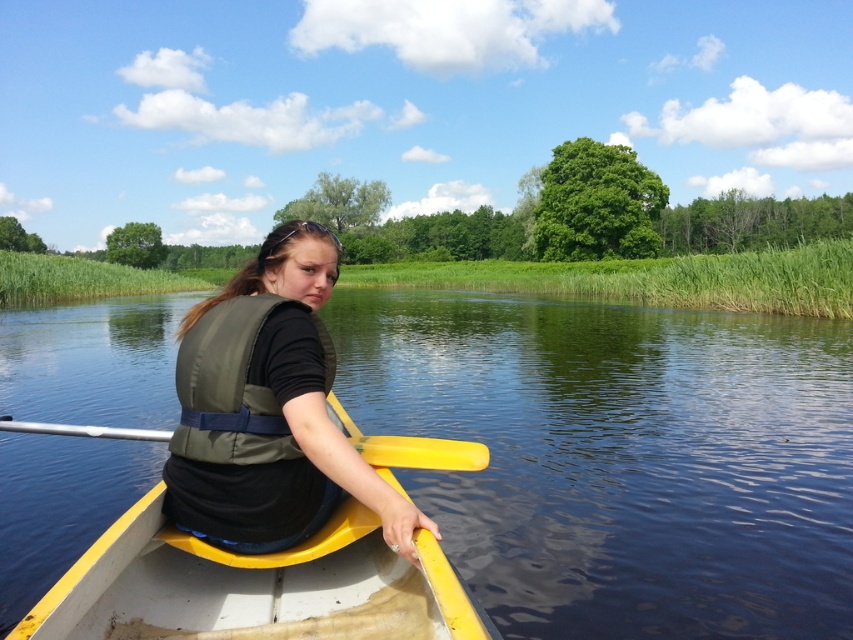
Question: Which point appears closest to the camera in this image?

Choices:
 (A) pyautogui.click(x=9, y=428)
 (B) pyautogui.click(x=323, y=461)

Answer: (B)

Question: Is olive green life vest at center below yellow plastic paddle at center?

Choices:
 (A) no
 (B) yes

Answer: (A)

Question: Can you confirm if yellow plastic boat at center is bigger than yellow plastic paddle at center?

Choices:
 (A) yes
 (B) no

Answer: (A)

Question: Which of the following is the closest to the observer?

Choices:
 (A) (187, 577)
 (B) (311, 420)
 (C) (605, 355)
 (D) (473, 444)

Answer: (B)

Question: Which object appears farthest from the camera in this image?

Choices:
 (A) olive green life vest at center
 (B) yellow plastic paddle at center

Answer: (B)

Question: From the image, what is the correct spatial relationship of yellow plastic boat at center in relation to olive green life vest at center?

Choices:
 (A) below
 (B) above

Answer: (A)